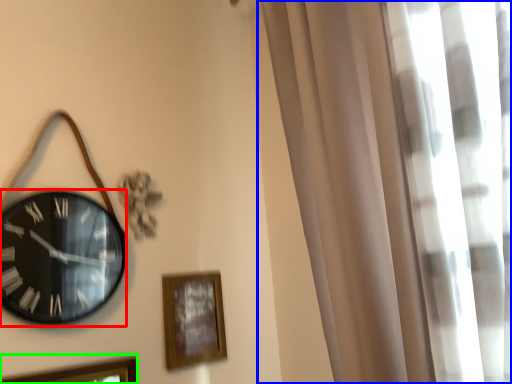
Question: Considering the real-world distances, which object is farthest from wall clock (highlighted by a red box)? curtain (highlighted by a blue box) or picture frame (highlighted by a green box)?

Choices:
 (A) curtain
 (B) picture frame

Answer: (A)